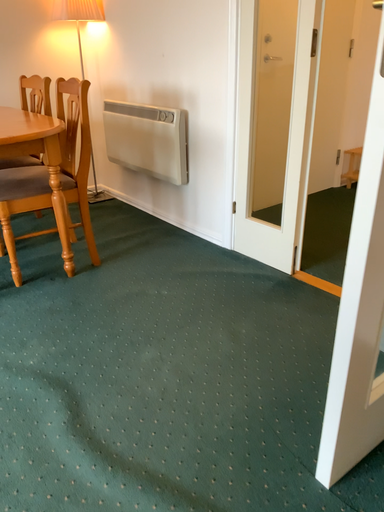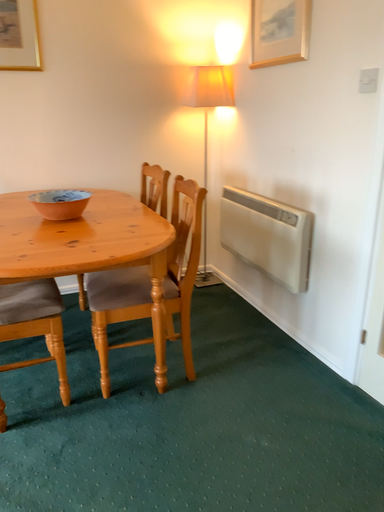
Question: Which way did the camera rotate in the video?

Choices:
 (A) rotated upward
 (B) rotated downward

Answer: (A)